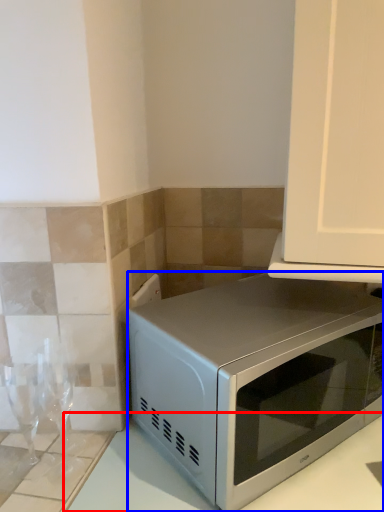
Question: Which object appears closest to the camera in this image, counter top (highlighted by a red box) or microwave oven (highlighted by a blue box)?

Choices:
 (A) counter top
 (B) microwave oven

Answer: (A)